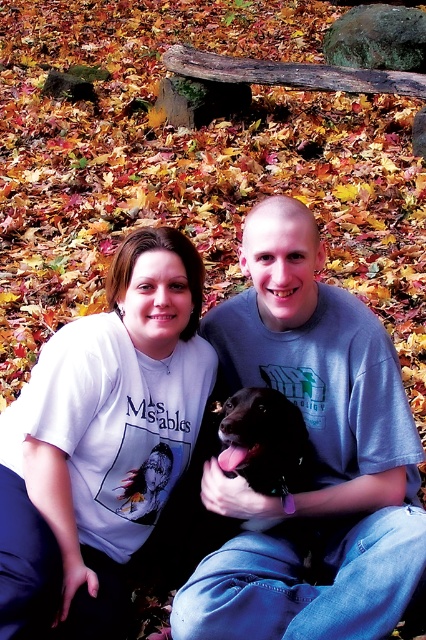
Describe the element at coordinates (100, 442) in the screenshot. I see `white matte t-shirt at center` at that location.

Which is more to the right, white matte t-shirt at center or shiny black dog at center?

From the viewer's perspective, shiny black dog at center appears more on the right side.

This screenshot has width=426, height=640. What are the coordinates of `white matte t-shirt at center` in the screenshot? It's located at (100, 442).

Does white cotton shirt at center appear on the left side of white matte t-shirt at center?

No, white cotton shirt at center is not to the left of white matte t-shirt at center.

Between point (305, 248) and point (201, 381), which one is positioned behind?

The point (201, 381) is more distant.

Where is `white cotton shirt at center`? The image size is (426, 640). white cotton shirt at center is located at coordinates (316, 451).

Based on the photo, which is more to the right, white cotton shirt at center or shiny black dog at center?

white cotton shirt at center is more to the right.

The height and width of the screenshot is (640, 426). What are the coordinates of `white cotton shirt at center` in the screenshot? It's located at (316, 451).

Based on the photo, who is more distant from viewer, (411, 440) or (288, 449)?

Point (411, 440)

This screenshot has height=640, width=426. I want to click on white cotton shirt at center, so click(316, 451).